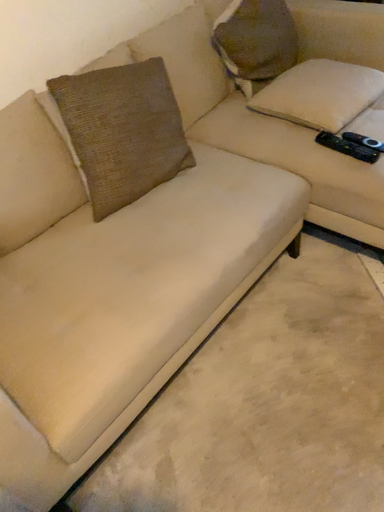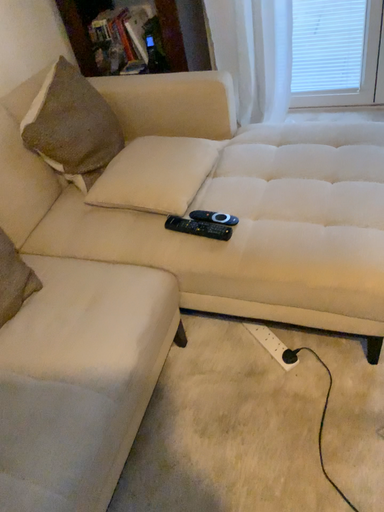
Question: How did the camera likely rotate when shooting the video?

Choices:
 (A) rotated left
 (B) rotated right

Answer: (B)